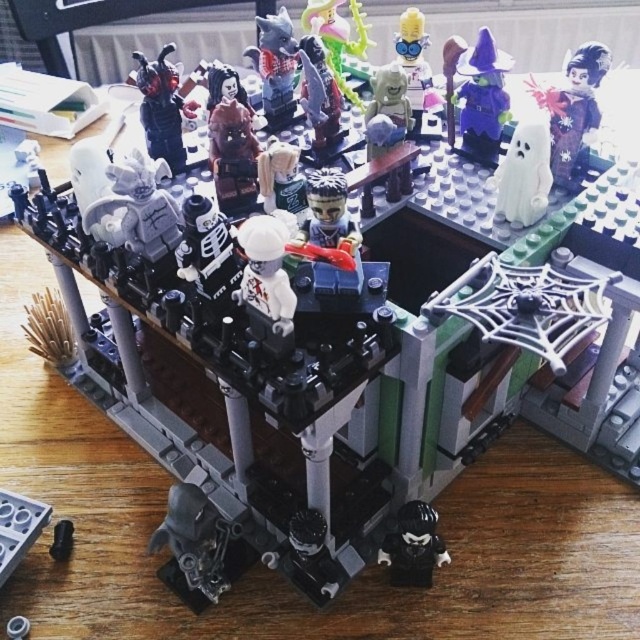
Question: Which of the following is the farthest from the observer?

Choices:
 (A) white matte ghost at upper right
 (B) black plastic figure at lower center
 (C) purple matte wizard hat at upper right

Answer: (C)

Question: Can you confirm if white matte ghost at upper right is positioned below black plastic figure at lower center?

Choices:
 (A) no
 (B) yes

Answer: (A)

Question: Which point is farther to the camera?

Choices:
 (A) (444, 72)
 (B) (531, 147)
 (C) (396, 538)
 (D) (264, 284)

Answer: (A)

Question: Which of the following is the closest to the observer?

Choices:
 (A) (467, 108)
 (B) (268, 253)
 (C) (278, 68)
 (D) (420, 536)

Answer: (B)

Question: Can you confirm if purple matte wizard hat at upper right is positioned to the left of white matte minifigure at center?

Choices:
 (A) no
 (B) yes

Answer: (A)

Question: Is white matte minifigure at center bigger than black plastic figure at lower center?

Choices:
 (A) no
 (B) yes

Answer: (B)